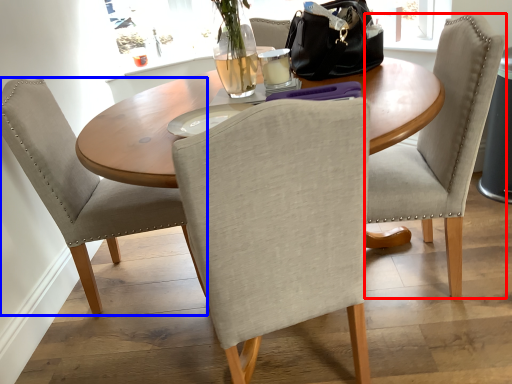
Question: Which point is further to the camera, chair (highlighted by a red box) or chair (highlighted by a blue box)?

Choices:
 (A) chair
 (B) chair

Answer: (B)